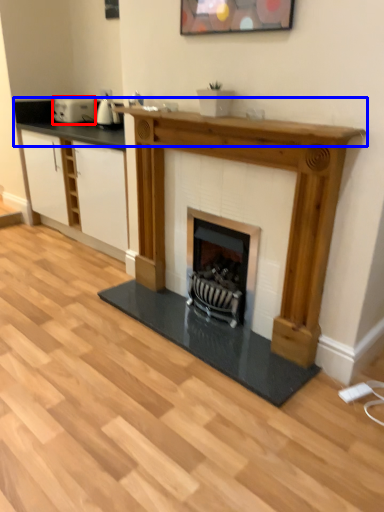
Question: Among these objects, which one is farthest to the camera, appliance (highlighted by a red box) or counter top (highlighted by a blue box)?

Choices:
 (A) appliance
 (B) counter top

Answer: (A)